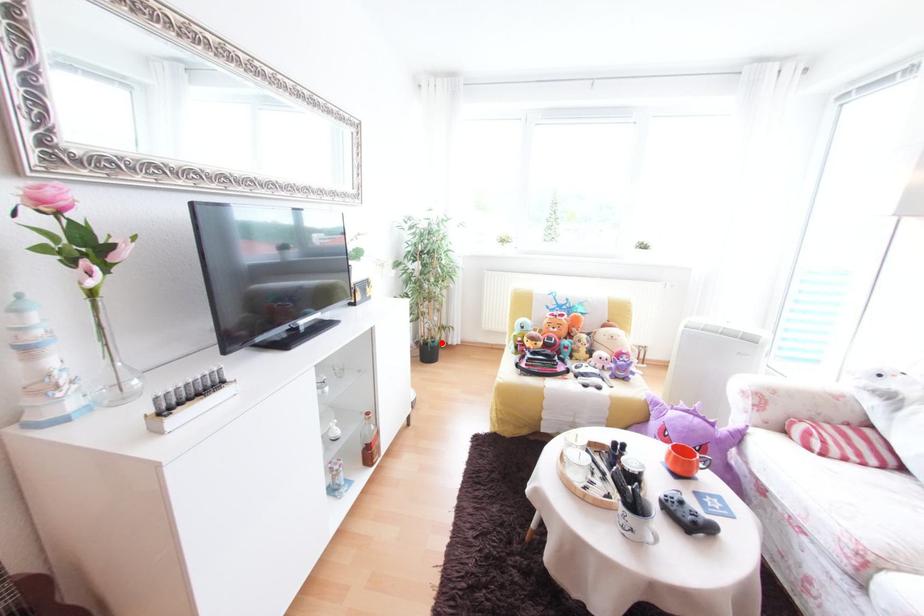
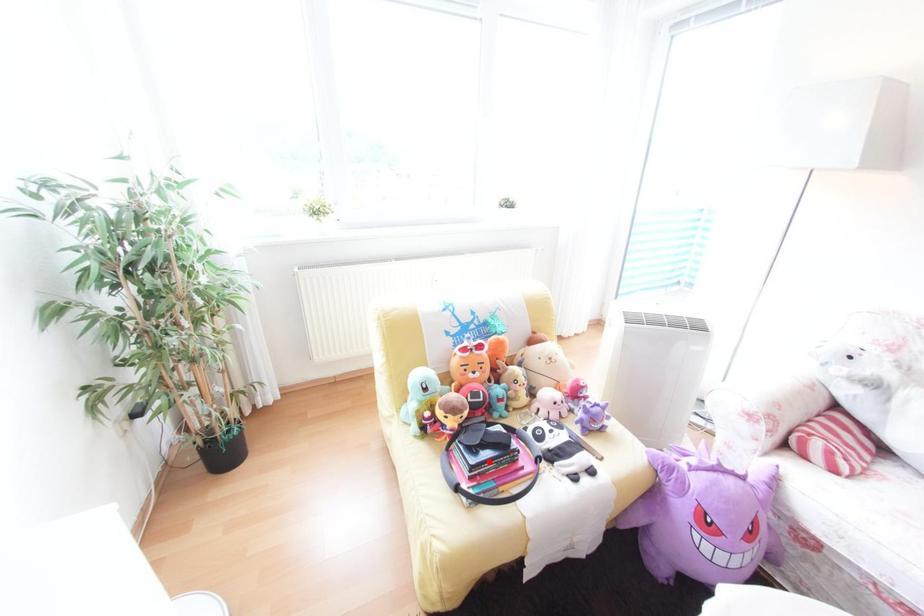
I am providing you with two images of the same scene from different viewpoints. A red point is marked on the first image and another point is marked on the second image. Is the marked point in image1 the same physical position as the marked point in image2?

No